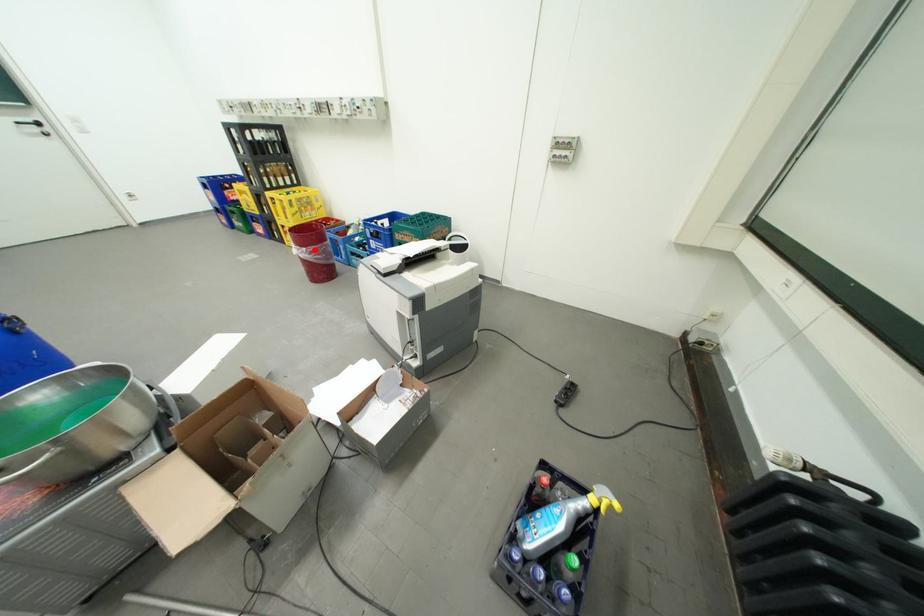
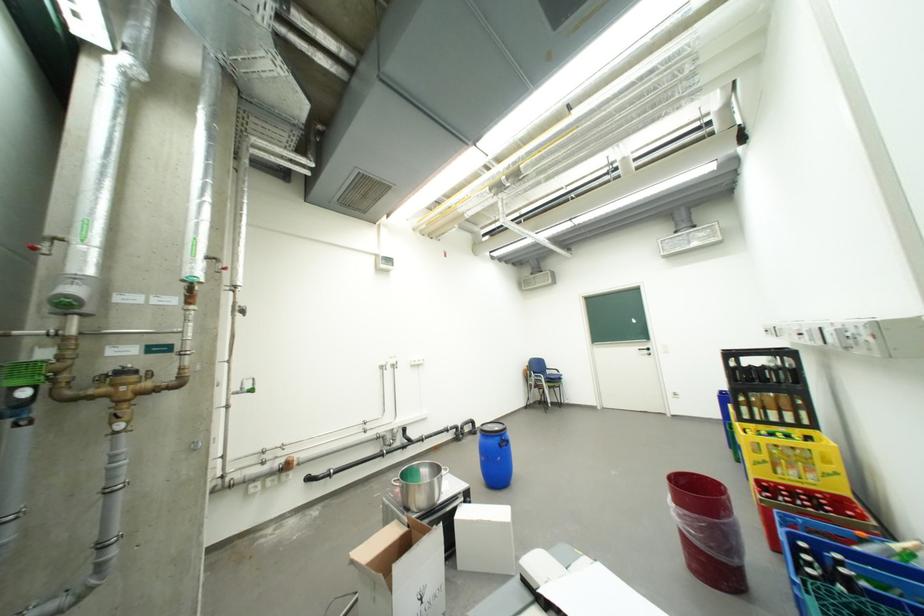
Question: I am providing you with two images of the same scene from different viewpoints. A red point is marked on the first image. Is the red point's position out of view in image 2?

Choices:
 (A) Yes
 (B) No

Answer: (B)